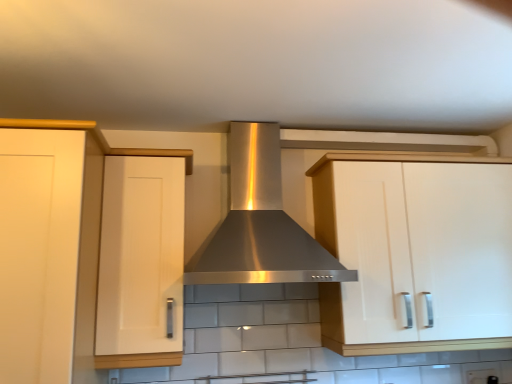
Question: Would you say stainless steel range hood at center is to the left or to the right of matte white cabinet at left, which is the 3th cabinetry from right to left, in the picture?

Choices:
 (A) left
 (B) right

Answer: (B)

Question: From a real-world perspective, is stainless steel range hood at center above or below matte white cabinet at left, which is the 3th cabinetry from right to left?

Choices:
 (A) above
 (B) below

Answer: (A)

Question: Which is nearer to the stainless steel range hood at center?

Choices:
 (A) white glossy cabinet at right, positioned as the first cabinetry in right-to-left order
 (B) white matte cabinet at left, the 2th cabinetry when ordered from left to right
 (C) matte white cabinet at left, which appears as the 1th cabinetry when viewed from the left

Answer: (B)

Question: Which object is the farthest from the white matte cabinet at left, the 2th cabinetry when ordered from left to right?

Choices:
 (A) white glossy cabinet at right, positioned as the first cabinetry in right-to-left order
 (B) matte white cabinet at left, which is the 3th cabinetry from right to left
 (C) stainless steel range hood at center

Answer: (A)